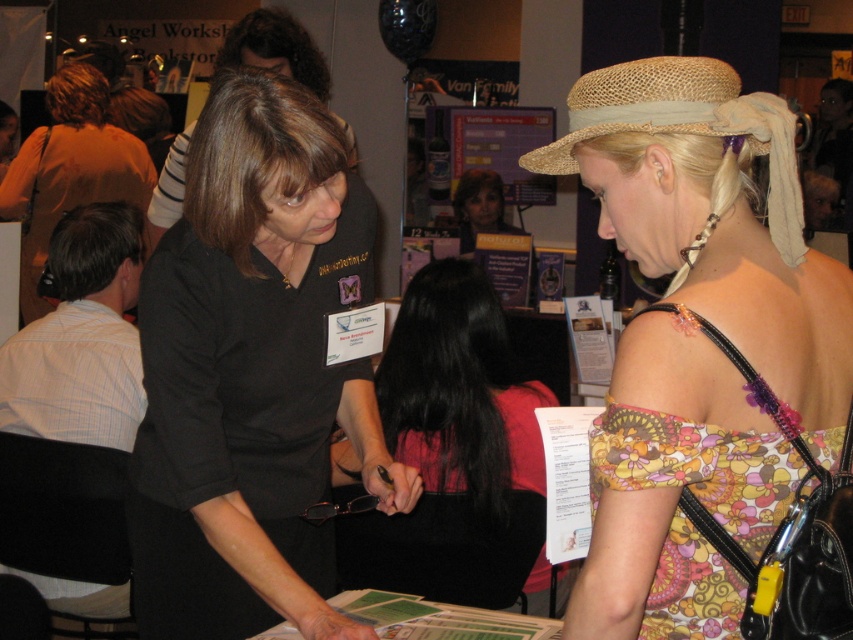
Between floral print dress at center and black matte shirt at center, which one is positioned higher?

floral print dress at center

This screenshot has width=853, height=640. Describe the element at coordinates (697, 339) in the screenshot. I see `floral print dress at center` at that location.

You are a GUI agent. You are given a task and a screenshot of the screen. Output one action in this format:
    pyautogui.click(x=<x>, y=<y>)
    Task: Click on the floral print dress at center
    This screenshot has width=853, height=640.
    Given the screenshot: What is the action you would take?
    pyautogui.click(x=697, y=339)

Describe the element at coordinates (685, 125) in the screenshot. I see `strawhat at center` at that location.

In the scene shown: Who is taller, strawhat at center or matte black shirt at left?

matte black shirt at left

Between point (778, 134) and point (96, 145), which one is positioned behind?

Point (96, 145)

Find the location of a particular element. strawhat at center is located at coordinates [685, 125].

Does black matte shirt at center have a greater width compared to strawhat at center?

Correct, the width of black matte shirt at center exceeds that of strawhat at center.

Describe the element at coordinates (252, 371) in the screenshot. This screenshot has height=640, width=853. I see `black matte shirt at center` at that location.

In order to click on black matte shirt at center in this screenshot , I will do `click(252, 371)`.